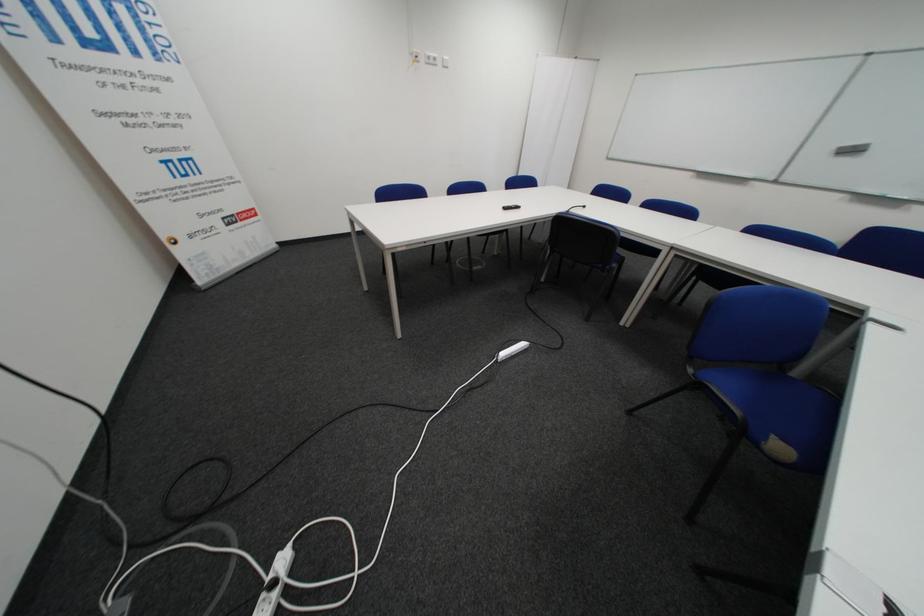
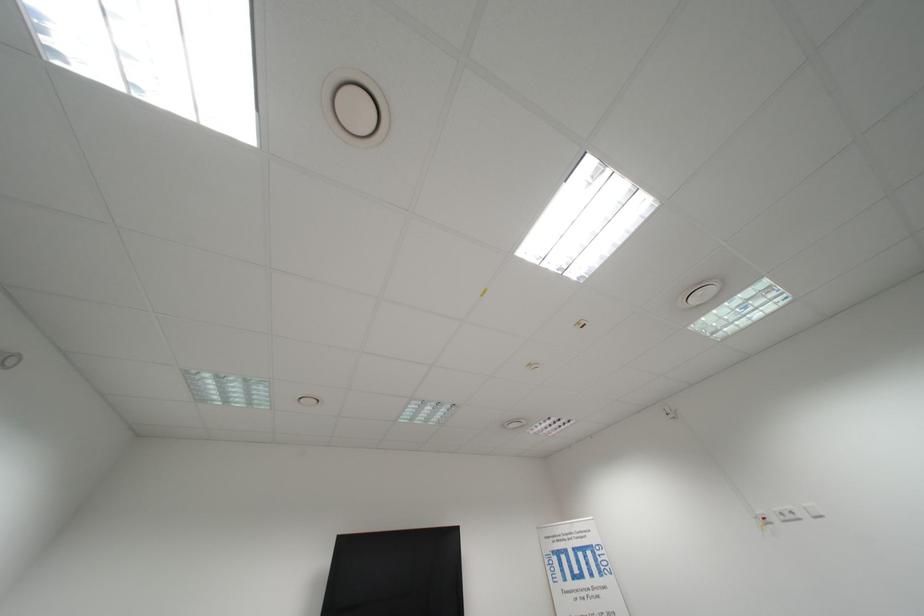
The point at (440, 62) is marked in the first image. Where is the corresponding point in the second image?

(796, 519)